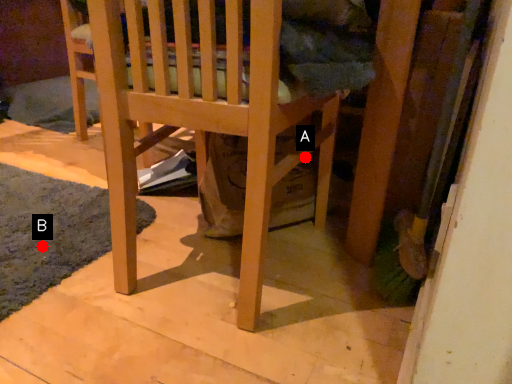
Question: Two points are circled on the image, labeled by A and B beside each circle. Which point is farther to the camera?

Choices:
 (A) A is further
 (B) B is further

Answer: (B)